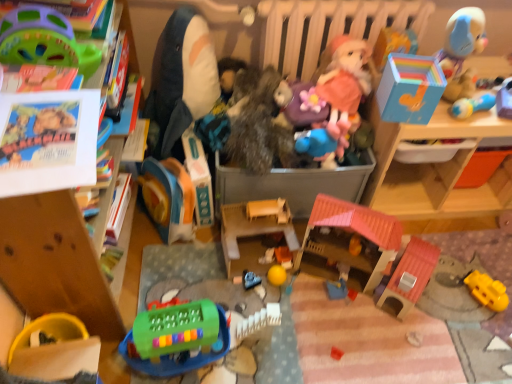
The width and height of the screenshot is (512, 384). Find the location of `vacant space in front of matte orange plush at center, the 13th toy when ordered from right to left`. vacant space in front of matte orange plush at center, the 13th toy when ordered from right to left is located at coordinates tap(165, 269).